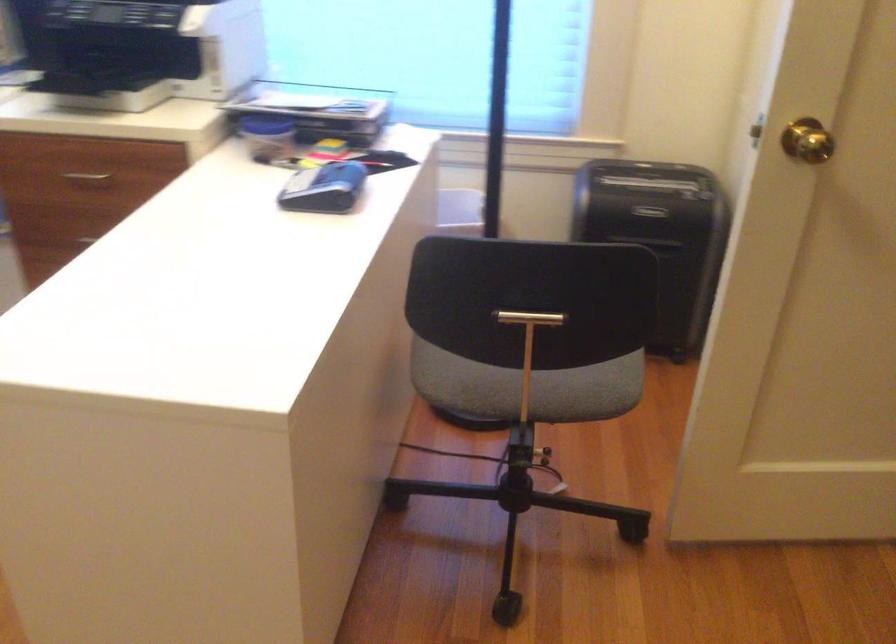
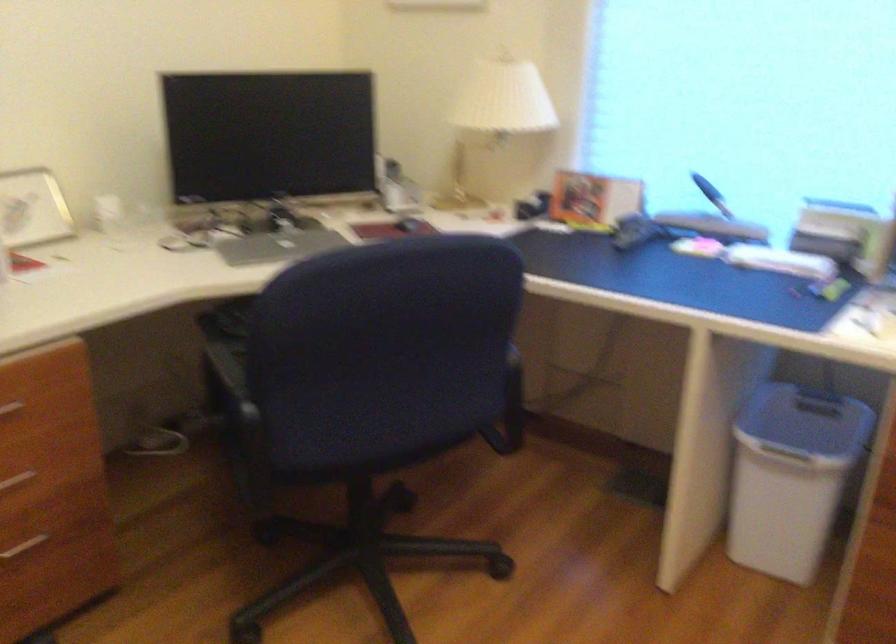
Question: How did the camera likely rotate?

Choices:
 (A) Left
 (B) Right
 (C) Up
 (D) Down

Answer: (A)